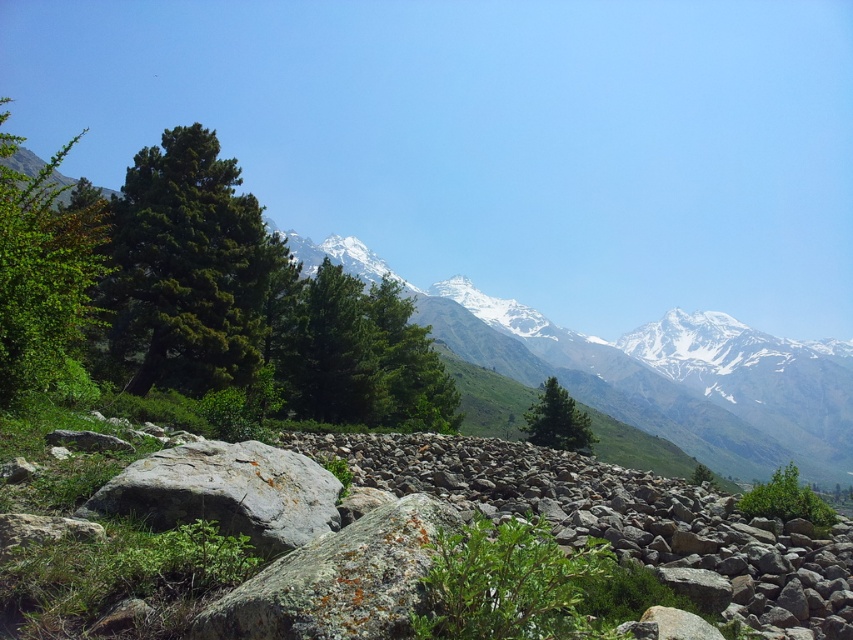
Question: Is green matte tree at left behind green matte tree at center?

Choices:
 (A) yes
 (B) no

Answer: (B)

Question: Can you confirm if green leafy tree at left is positioned to the right of green leafy tree at lower right?

Choices:
 (A) yes
 (B) no

Answer: (B)

Question: Estimate the real-world distances between objects in this image. Which object is closer to the green matte tree at left?

Choices:
 (A) green matte tree at center
 (B) green leafy tree at center
 (C) green leafy tree at lower right

Answer: (B)

Question: Which object is closer to the camera taking this photo?

Choices:
 (A) green matte tree at center
 (B) green leafy tree at left
 (C) green matte tree at left
 (D) green leafy tree at center

Answer: (B)

Question: Considering the real-world distances, which object is farthest from the snowy rock formation at upper center?

Choices:
 (A) green leafy tree at left
 (B) green leafy tree at lower right

Answer: (A)

Question: Is green matte tree at left closer to the viewer compared to green matte tree at center?

Choices:
 (A) yes
 (B) no

Answer: (A)